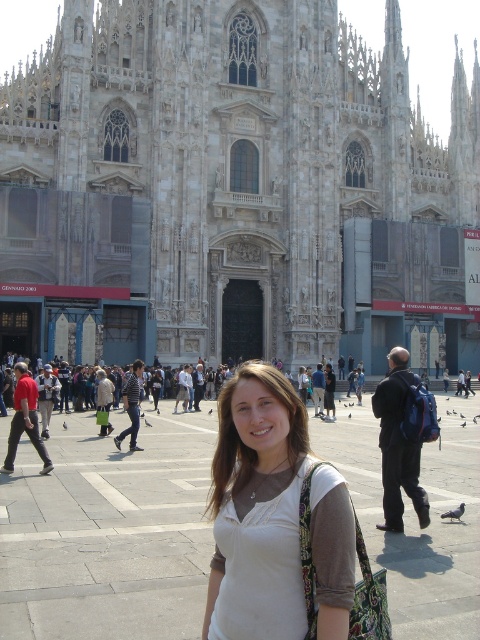
You are standing in front of the cathedral and want to take a photo that includes both the gray stone church at center and the white fabric shirt at center. Which object should you focus on first to ensure both are in frame?

The gray stone church at center is much taller than the white fabric shirt at center, so you should focus on the gray stone church at center first to ensure both are in frame.

You are standing in front of the cathedral and see the gray stone church at center and the white fabric shirt at center. Which object is positioned to the right of the other?

The gray stone church at center is to the right of the white fabric shirt at center.

Based on the scene description, what is the significance of the point at coordinates [235,189]?

The point at coordinates [235,189] corresponds to the gray stone church at center.